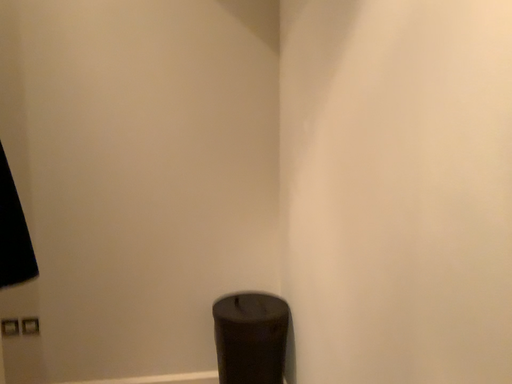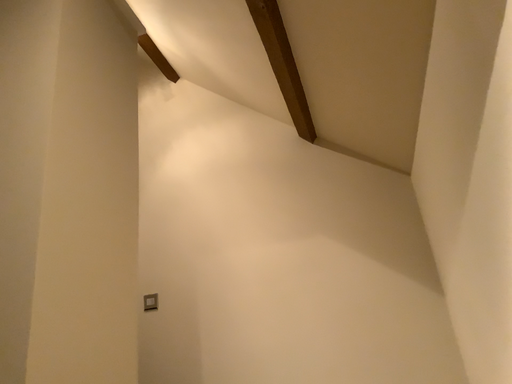
Question: How did the camera likely rotate when shooting the video?

Choices:
 (A) rotated left
 (B) rotated right

Answer: (A)